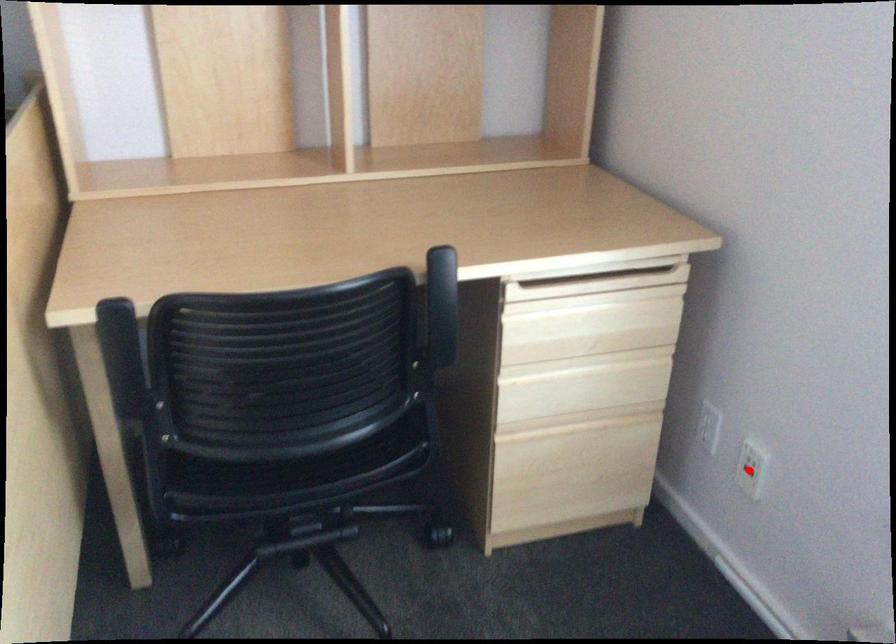
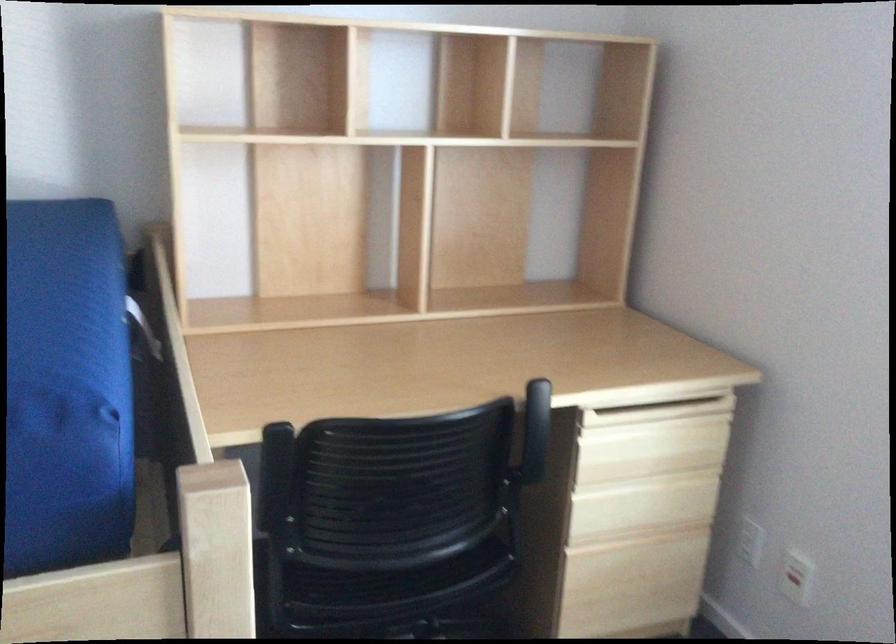
The point at the highlighted location is marked in the first image. Where is the corresponding point in the second image?

(795, 583)